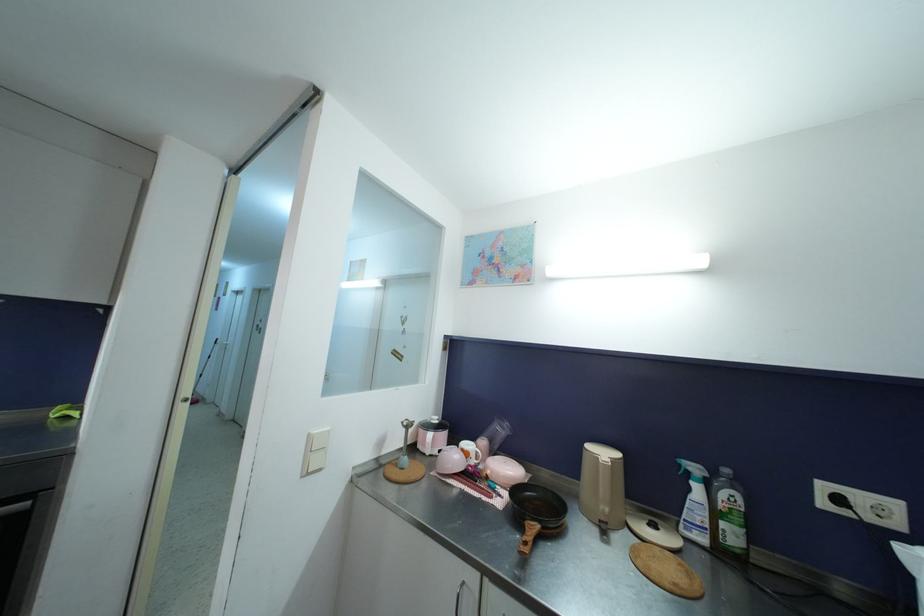
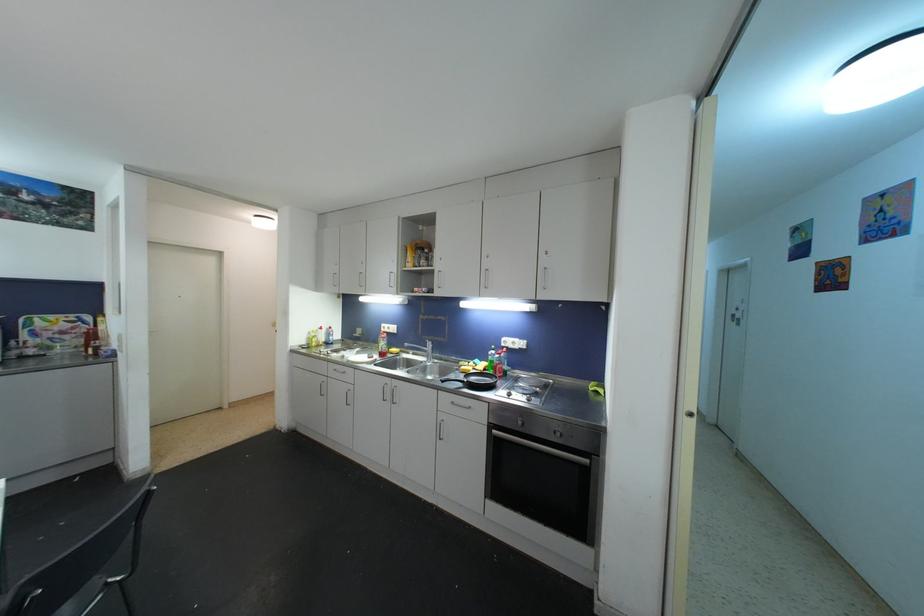
Question: Based on the continuous images, in which direction is the camera rotating? Reply with the corresponding letter.

Choices:
 (A) Left
 (B) Right
 (C) Up
 (D) Down

Answer: (A)